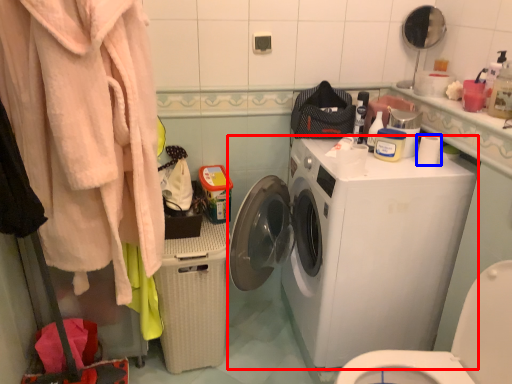
Question: Among these objects, which one is nearest to the camera, washing machine (highlighted by a red box) or toilet paper (highlighted by a blue box)?

Choices:
 (A) washing machine
 (B) toilet paper

Answer: (A)